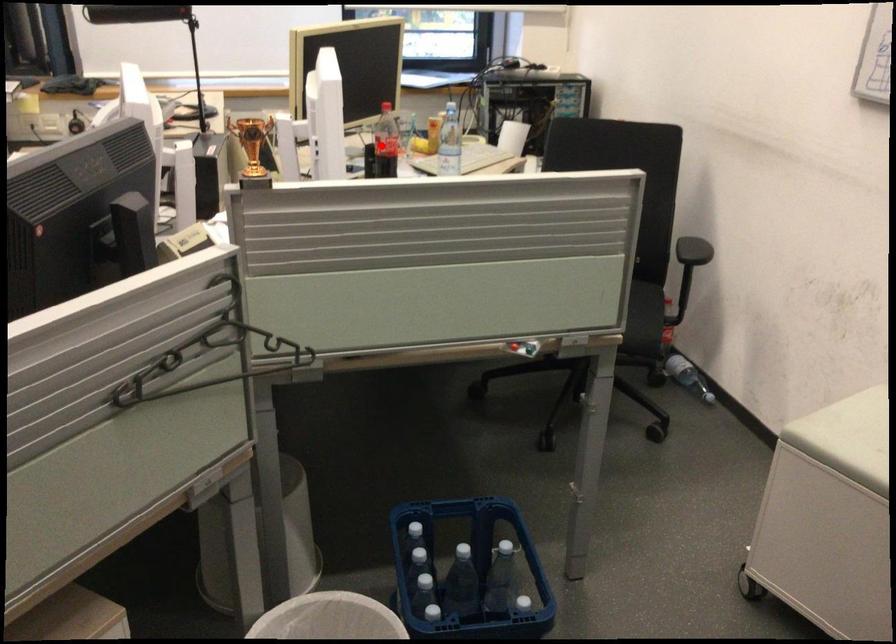
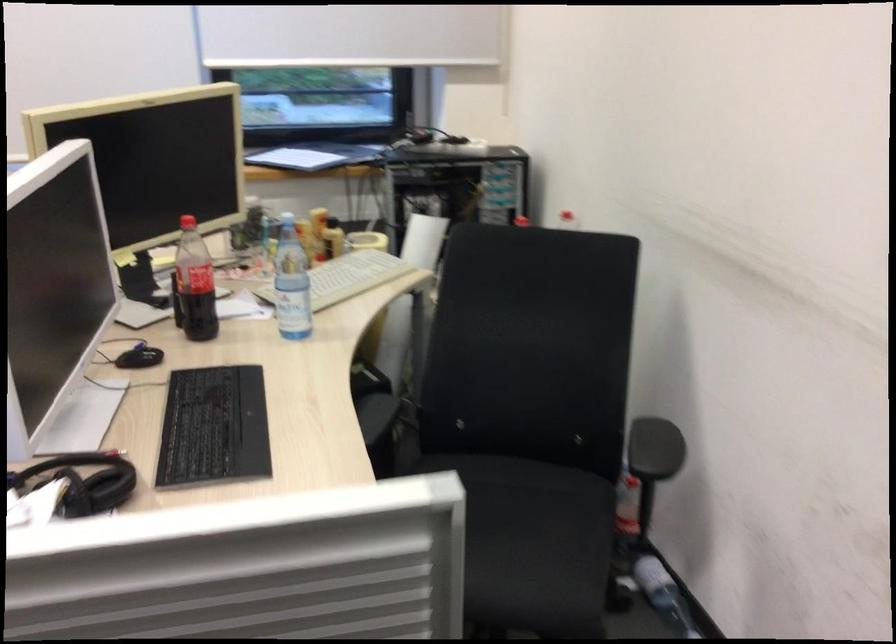
Question: I am providing you with two images of the same scene from different viewpoints. A red point is shown in image1. For the corresponding object point in image2, is it positioned nearer or farther from the camera?

Choices:
 (A) Nearer
 (B) Farther

Answer: (A)